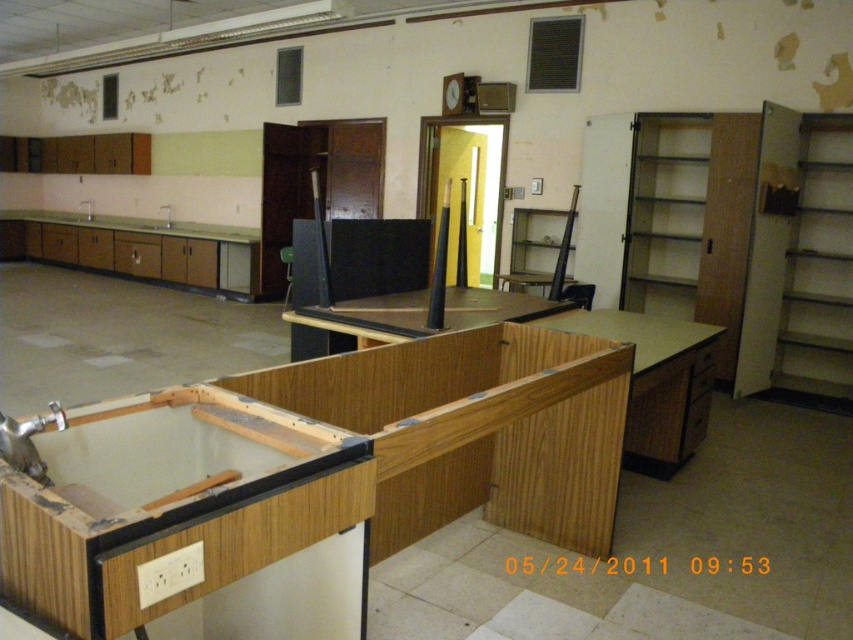
Between white glossy sink at left and white glossy sink at lower left, which one appears on the right side from the viewer's perspective?

white glossy sink at left

Can you confirm if white glossy sink at left is positioned below white glossy sink at lower left?

Yes.

Is point (62, 220) closer to camera compared to point (70, 220)?

No.

Where is `white glossy sink at left`? The width and height of the screenshot is (853, 640). white glossy sink at left is located at coordinates (91, 220).

Which is in front, point (111, 227) or point (164, 227)?

Point (164, 227)

Does point (97, 221) come farther from viewer compared to point (169, 220)?

Yes, it is.

Where is `white glossy sink at left`? white glossy sink at left is located at coordinates (91, 220).

Between point (143, 225) and point (74, 220), which one is positioned in front?

Positioned in front is point (143, 225).

Is white glossy sink at center to the left of white glossy sink at lower left from the viewer's perspective?

No, white glossy sink at center is not to the left of white glossy sink at lower left.

The image size is (853, 640). Describe the element at coordinates (160, 225) in the screenshot. I see `white glossy sink at center` at that location.

This screenshot has height=640, width=853. I want to click on white glossy sink at center, so click(160, 225).